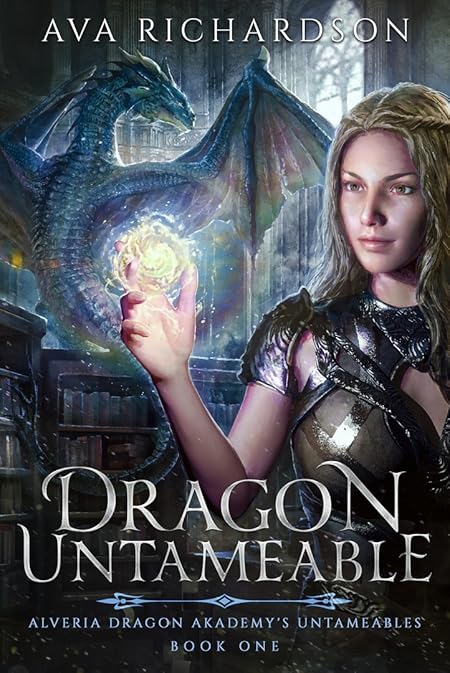
Identify the location of window. The image size is (450, 673). (342, 62).